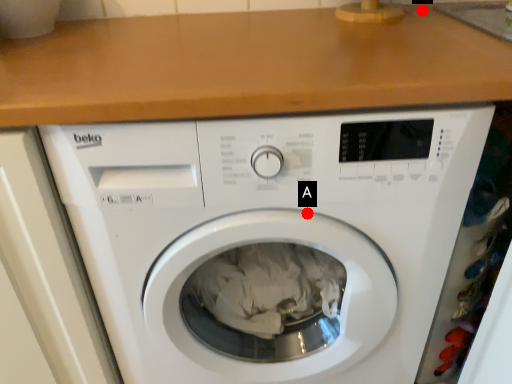
Question: Two points are circled on the image, labeled by A and B beside each circle. Which point is closer to the camera?

Choices:
 (A) A is closer
 (B) B is closer

Answer: (A)